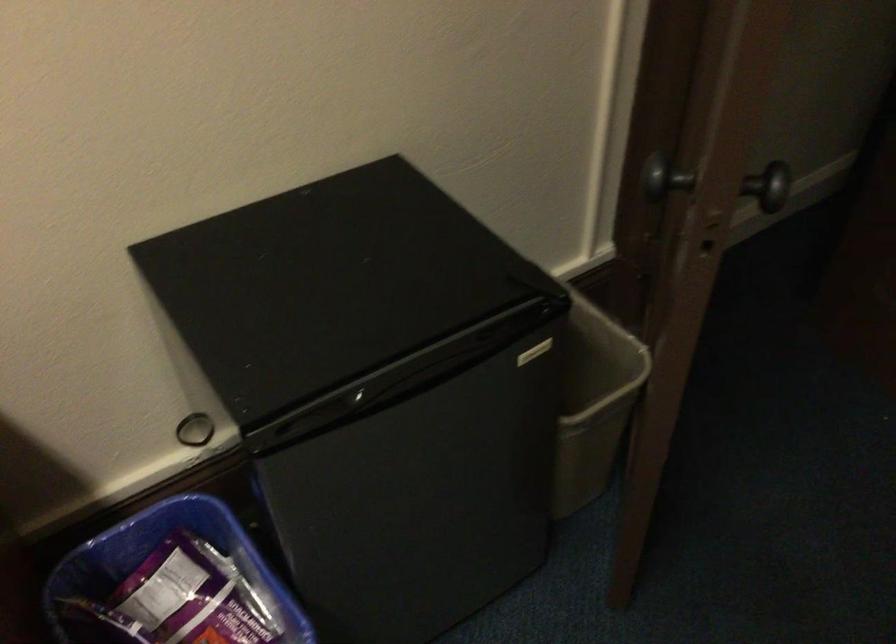
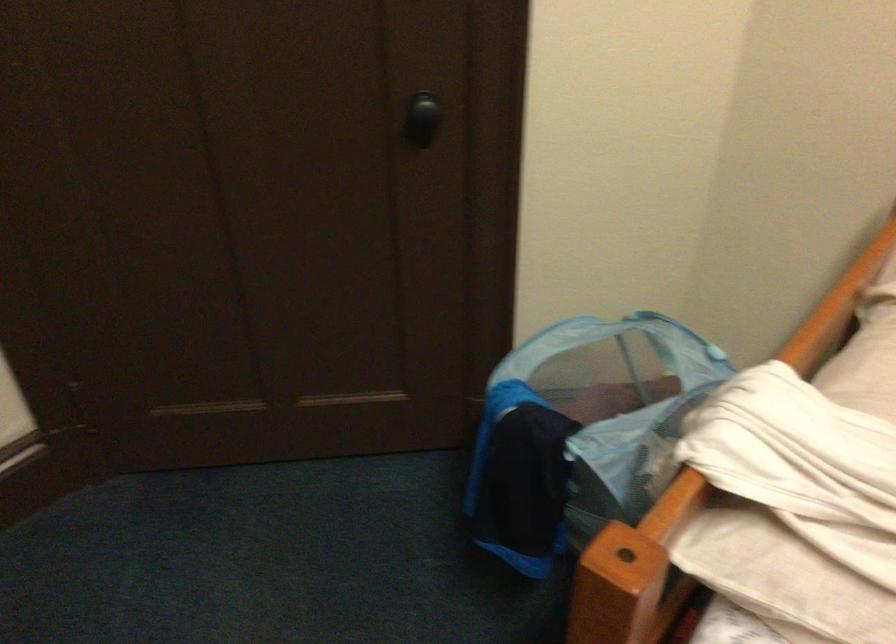
Based on the continuous images, in which direction is the camera rotating?

The camera rotated toward right-down.